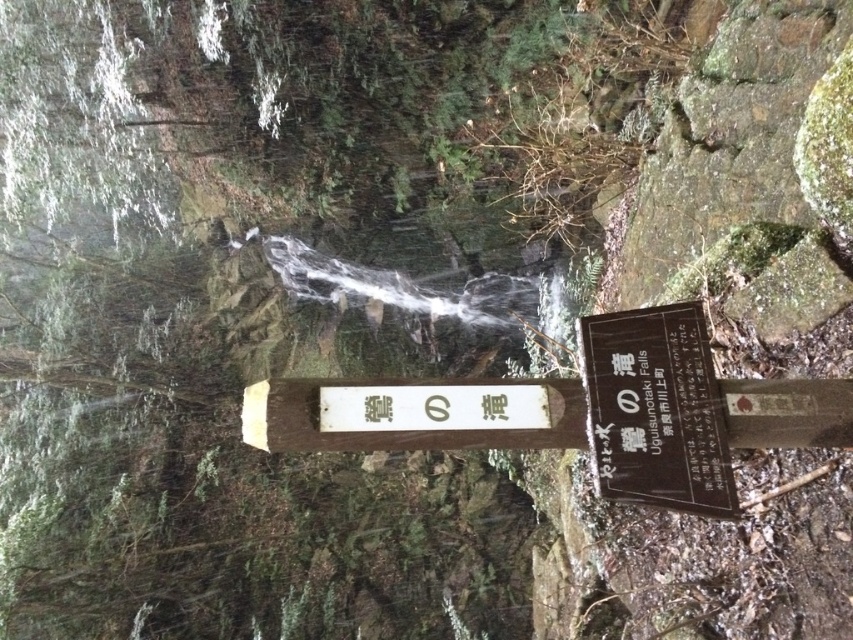
You are a hiker who wants to take a photo of both the clear water at center and the black wood sign at center. Since you want both objects to be fully visible in the frame, which one should you focus on first to ensure they are both in focus?

The clear water at center is taller than the black wood sign at center. Therefore, you should focus on the clear water at center first to ensure both are in focus, as focusing on the farther object helps keep both in focus when there is a height difference.